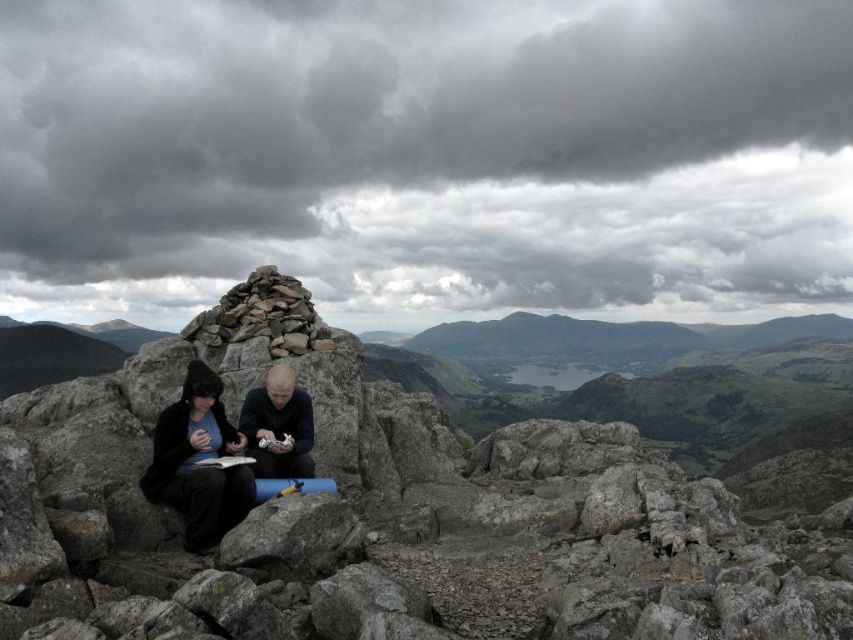
Between point (231, 440) and point (286, 376), which one is positioned in front?

Point (231, 440)

From the picture: Can you confirm if matte black jacket at center is positioned above black matte jacket at center?

No.

Is point (231, 444) closer to camera compared to point (280, 477)?

Yes, point (231, 444) is in front of point (280, 477).

The image size is (853, 640). I want to click on matte black jacket at center, so click(196, 460).

Is matte black jacket at center to the right of gray rock pile at center from the viewer's perspective?

Yes, matte black jacket at center is to the right of gray rock pile at center.

Is matte black jacket at center thinner than gray rock pile at center?

Yes, matte black jacket at center is thinner than gray rock pile at center.

Where is `matte black jacket at center`? matte black jacket at center is located at coordinates (196, 460).

From the picture: Can you confirm if gray rock pile at center is positioned below black matte jacket at center?

No.

Who is positioned more to the right, gray rock pile at center or black matte jacket at center?

From the viewer's perspective, black matte jacket at center appears more on the right side.

What do you see at coordinates (263, 316) in the screenshot? I see `gray rock pile at center` at bounding box center [263, 316].

Identify the location of gray rock pile at center. The image size is (853, 640). (263, 316).